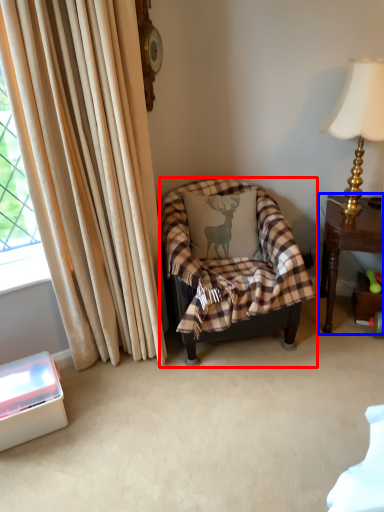
Question: Which object appears farthest to the camera in this image, chair (highlighted by a red box) or table (highlighted by a blue box)?

Choices:
 (A) chair
 (B) table

Answer: (B)